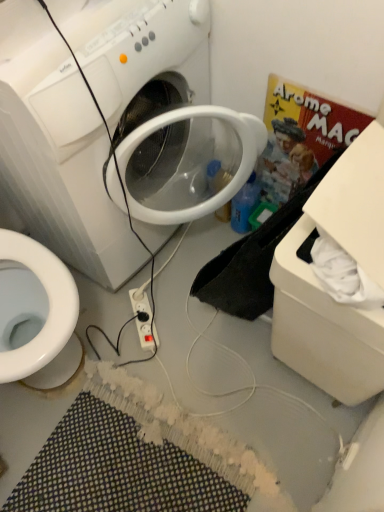
Identify the location of free spot in front of white plastic power outlet at center. The image size is (384, 512). (150, 369).